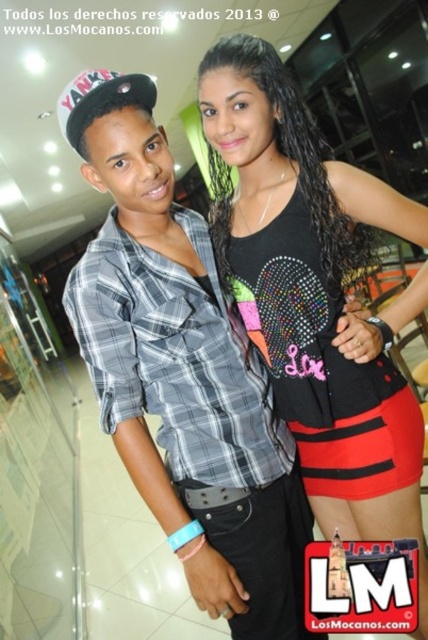
Does plaid fabric shirt at center have a smaller size compared to black sequined tank top at center?

Incorrect, plaid fabric shirt at center is not smaller in size than black sequined tank top at center.

Is point (205, 289) positioned in front of point (406, 412)?

Yes, it is in front of point (406, 412).

Is point (124, 166) positioned before point (365, 442)?

Yes, it is in front of point (365, 442).

Identify the location of plaid fabric shirt at center. (181, 372).